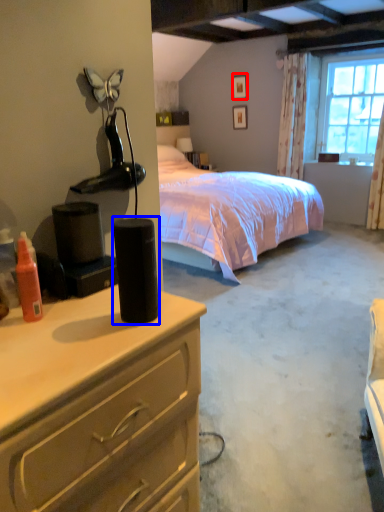
Question: Among these objects, which one is nearest to the camera, picture frame (highlighted by a red box) or speaker (highlighted by a blue box)?

Choices:
 (A) picture frame
 (B) speaker

Answer: (B)